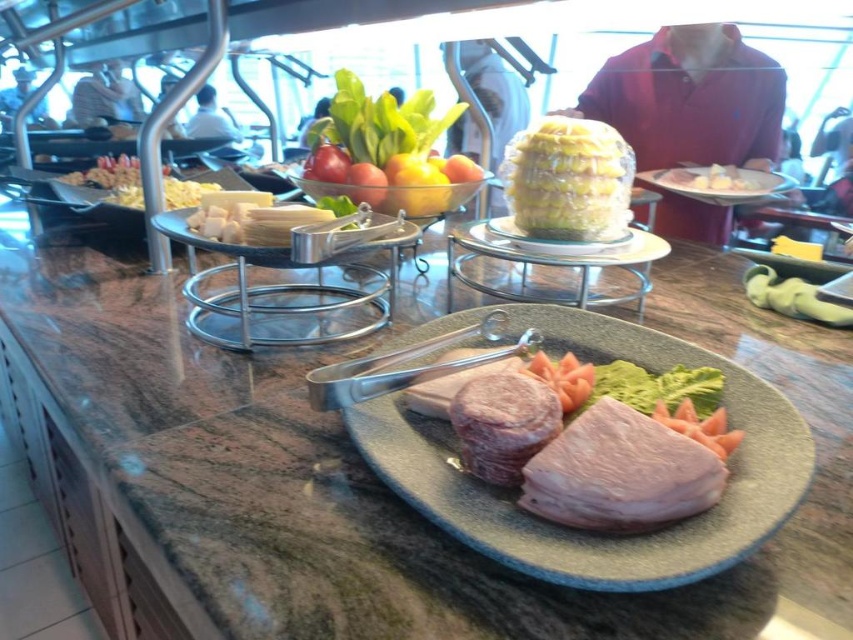
Who is shorter, pink matte meat at center or green leafy vegetable at center?

Standing shorter between the two is green leafy vegetable at center.

What do you see at coordinates (582, 529) in the screenshot?
I see `pink matte meat at center` at bounding box center [582, 529].

Find the location of `pink matte meat at center`. pink matte meat at center is located at coordinates (582, 529).

Can you confirm if shiny green lettuce at center is positioned below green leafy vegetable at center?

No, shiny green lettuce at center is not below green leafy vegetable at center.

In the scene shown: Is shiny green lettuce at center in front of green leafy vegetable at center?

No, shiny green lettuce at center is further to the viewer.

Is point (364, 157) closer to camera compared to point (758, 278)?

No.

The image size is (853, 640). What are the coordinates of `shiny green lettuce at center` in the screenshot? It's located at (386, 148).

Does pink matte meat at center appear over white plastic plate at center?

Actually, pink matte meat at center is below white plastic plate at center.

Is pink matte meat at center thinner than white plastic plate at center?

Yes.

The height and width of the screenshot is (640, 853). What do you see at coordinates (582, 529) in the screenshot?
I see `pink matte meat at center` at bounding box center [582, 529].

Where is `pink matte meat at center`? Image resolution: width=853 pixels, height=640 pixels. pink matte meat at center is located at coordinates (582, 529).